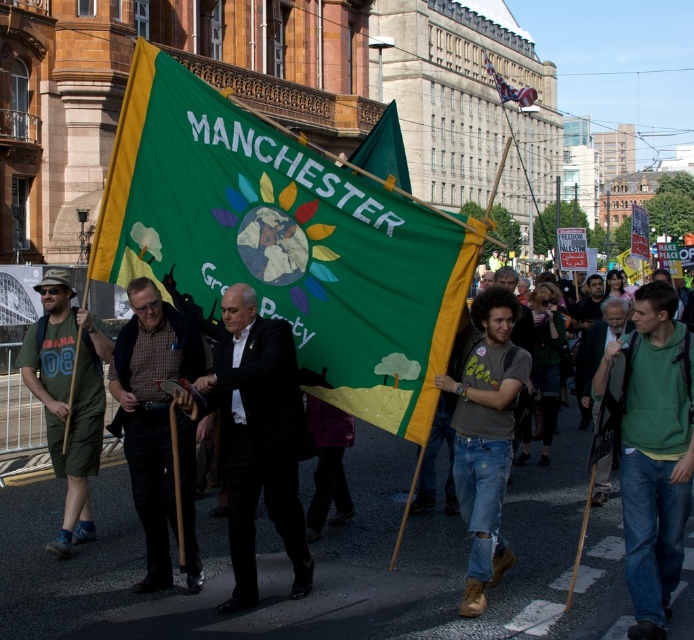
Is brown checkered shirt at center bigger than green cotton t-shirt at left?

Incorrect, brown checkered shirt at center is not larger than green cotton t-shirt at left.

Locate an element on the screen. The width and height of the screenshot is (694, 640). brown checkered shirt at center is located at coordinates (151, 412).

The image size is (694, 640). In order to click on brown checkered shirt at center in this screenshot , I will do `click(151, 412)`.

Which of these two, green cotton hoodie at lower right or brown leather shoes at lower center, stands taller?

With more height is brown leather shoes at lower center.

Is green cotton hoodie at lower right closer to the viewer compared to brown leather shoes at lower center?

Yes, it is in front of brown leather shoes at lower center.

The image size is (694, 640). Identify the location of green cotton hoodie at lower right. (652, 452).

Image resolution: width=694 pixels, height=640 pixels. In order to click on green cotton hoodie at lower right in this screenshot , I will do `click(652, 452)`.

Can you confirm if black satin suit at center is bigger than green fabric sign at center?

Yes.

Is black satin suit at center to the right of green fabric sign at center from the viewer's perspective?

No, black satin suit at center is not to the right of green fabric sign at center.

Who is more distant from viewer, (270, 429) or (625, 305)?

Point (625, 305)

Where is `black satin suit at center`? black satin suit at center is located at coordinates (257, 438).